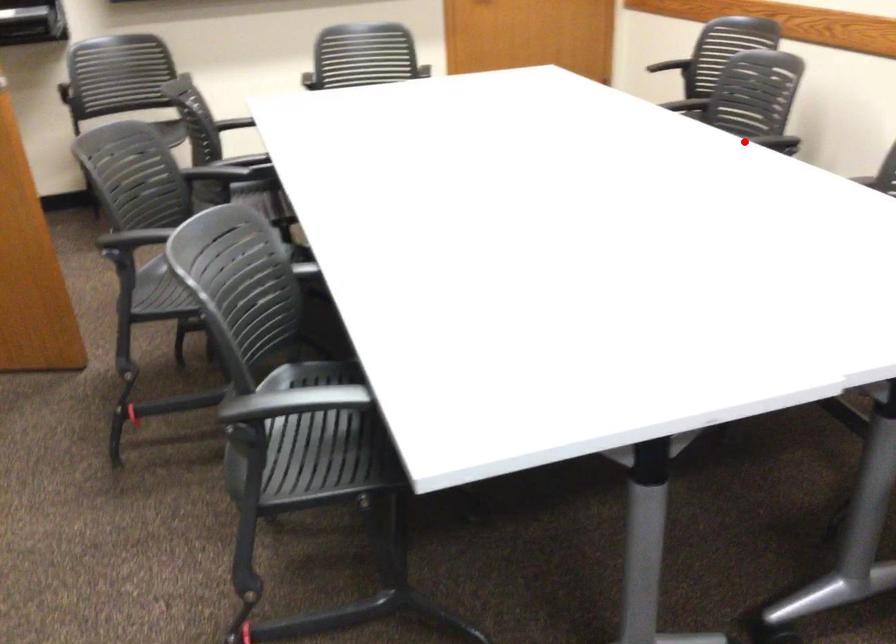
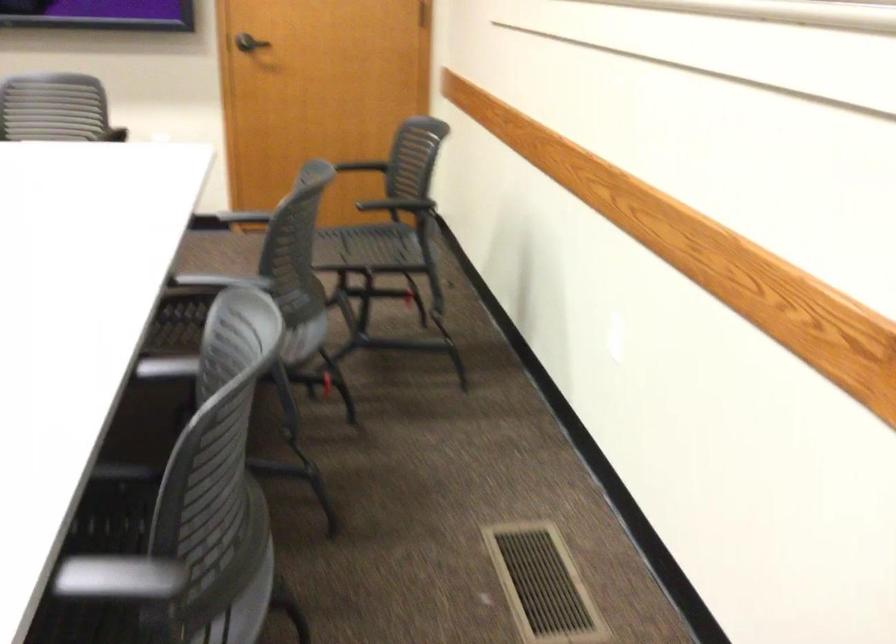
In the second image, find the point that corresponds to the highlighted location in the first image.

(220, 281)